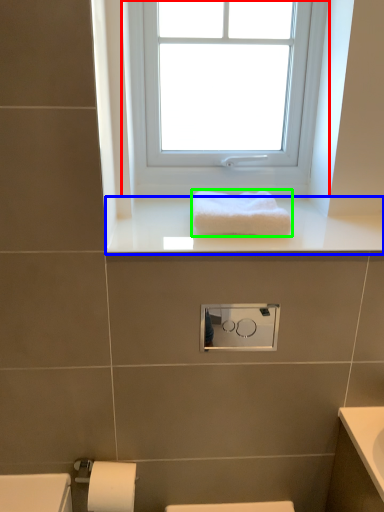
Question: Which is farther away from window (highlighted by a red box)? window sill (highlighted by a blue box) or towel (highlighted by a green box)?

Choices:
 (A) window sill
 (B) towel

Answer: (B)